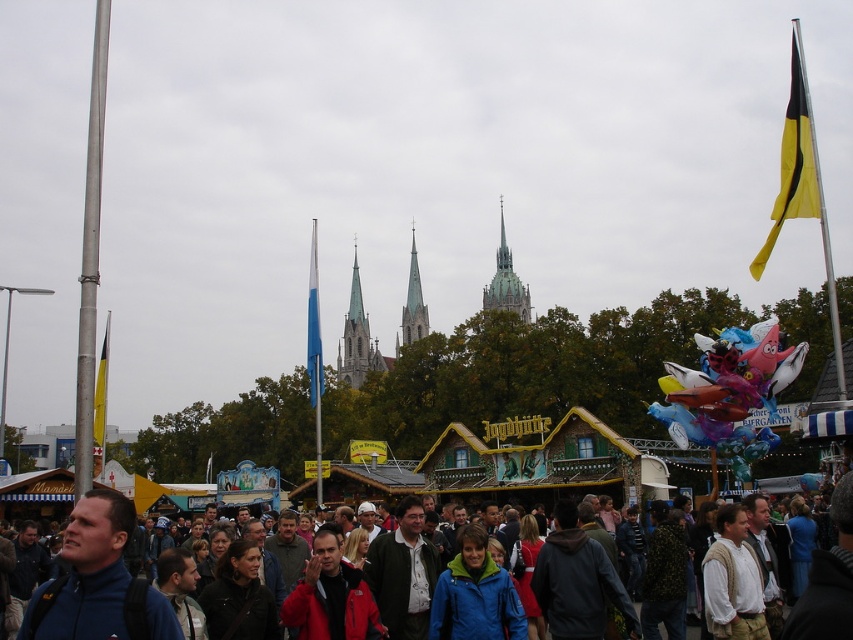
You are a photographer standing at the edge of the multicolored fabric crowd at center. You want to capture a photo that includes both the crowd and the Biergarten chalet in the background. Given that your camera has a maximum zoom range of 100 feet, will you be able to include both in the same frame?

The multicolored fabric crowd at center and the Biergarten chalet are 175.42 feet apart. Since your camera can only zoom up to 100 feet, you won that be able to capture both in the same frame as the distance exceeds the maximum zoom range.

You are standing in the crowd at the festival and want to take a photo of both the yellow fabric flag at upper right and the smooth gray stone tower at center. Which object should you aim your camera at first to ensure both are in the frame?

You should aim your camera at the yellow fabric flag at upper right first because it is positioned over the smooth gray stone tower at center, so capturing it first ensures both are visible in the frame.